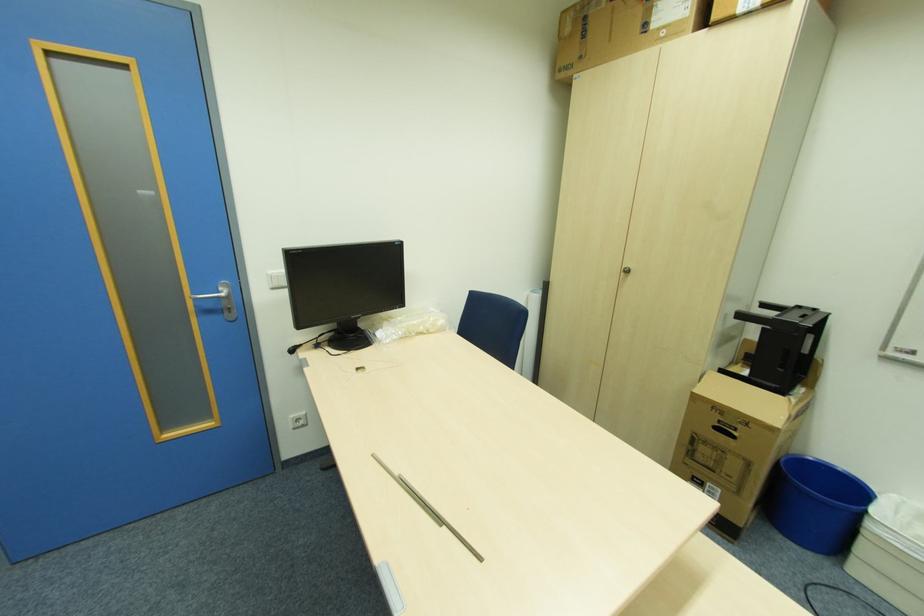
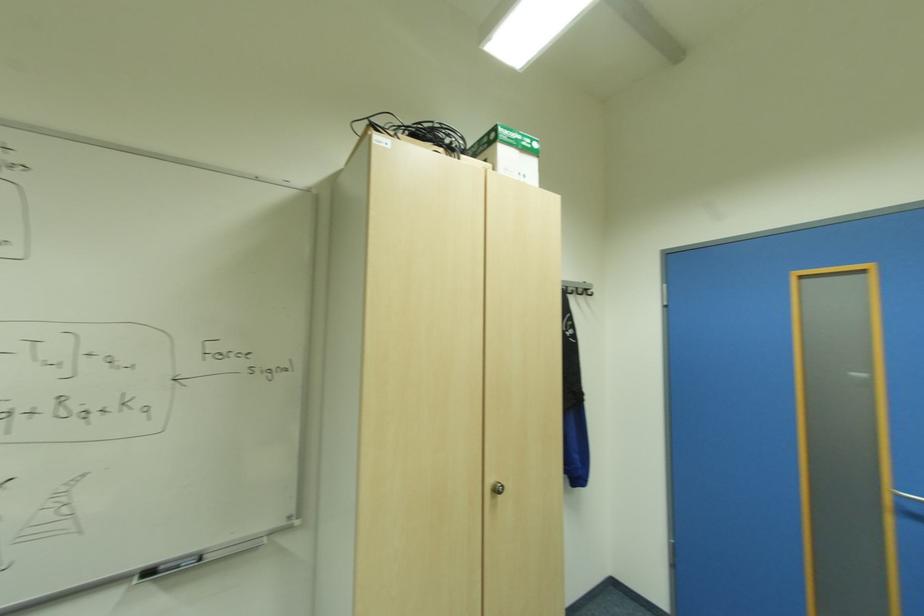
Question: Based on the continuous images, in which direction is the camera rotating? Reply with the corresponding letter.

Choices:
 (A) Left
 (B) Right
 (C) Up
 (D) Down

Answer: (A)